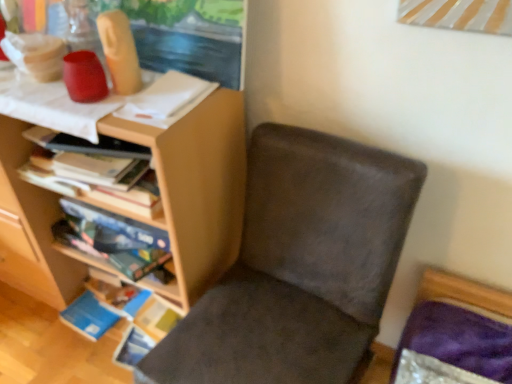
Question: From the image's perspective, is wooden bookshelf at left, which ranks as the 2th shelf in top-to-bottom order, below suede-like brown chair at center?

Choices:
 (A) no
 (B) yes

Answer: (A)

Question: Could you tell me if wooden bookshelf at left, which ranks as the 2th shelf in top-to-bottom order, is facing suede-like brown chair at center?

Choices:
 (A) no
 (B) yes

Answer: (A)

Question: Can you confirm if wooden bookshelf at left, which ranks as the 2th shelf in top-to-bottom order, is positioned to the left of suede-like brown chair at center?

Choices:
 (A) yes
 (B) no

Answer: (A)

Question: From a real-world perspective, is wooden bookshelf at left, the first shelf from the bottom, physically below suede-like brown chair at center?

Choices:
 (A) yes
 (B) no

Answer: (B)

Question: From the image's perspective, is wooden bookshelf at left, the first shelf from the bottom, above suede-like brown chair at center?

Choices:
 (A) no
 (B) yes

Answer: (B)

Question: Can you confirm if wooden bookshelf at left, the first shelf from the bottom, is thinner than suede-like brown chair at center?

Choices:
 (A) no
 (B) yes

Answer: (B)

Question: Is suede-like brown chair at center with matte wood shelf at upper left, which ranks as the first shelf in top-to-bottom order?

Choices:
 (A) no
 (B) yes

Answer: (A)

Question: From a real-world perspective, is suede-like brown chair at center located higher than matte wood shelf at upper left, which ranks as the first shelf in top-to-bottom order?

Choices:
 (A) yes
 (B) no

Answer: (B)

Question: Considering the relative positions of suede-like brown chair at center and matte wood shelf at upper left, which is counted as the second shelf, starting from the bottom, in the image provided, is suede-like brown chair at center in front of matte wood shelf at upper left, which is counted as the second shelf, starting from the bottom,?

Choices:
 (A) yes
 (B) no

Answer: (A)

Question: Is suede-like brown chair at center not within matte wood shelf at upper left, which ranks as the first shelf in top-to-bottom order?

Choices:
 (A) no
 (B) yes

Answer: (B)

Question: Is suede-like brown chair at center to the right of matte wood shelf at upper left, which ranks as the first shelf in top-to-bottom order, from the viewer's perspective?

Choices:
 (A) yes
 (B) no

Answer: (A)

Question: Is matte wood shelf at upper left, which ranks as the first shelf in top-to-bottom order, inside suede-like brown chair at center?

Choices:
 (A) yes
 (B) no

Answer: (B)

Question: Does suede-like brown chair at center have a smaller size compared to wooden bookshelf at left, which ranks as the 2th shelf in top-to-bottom order?

Choices:
 (A) yes
 (B) no

Answer: (B)